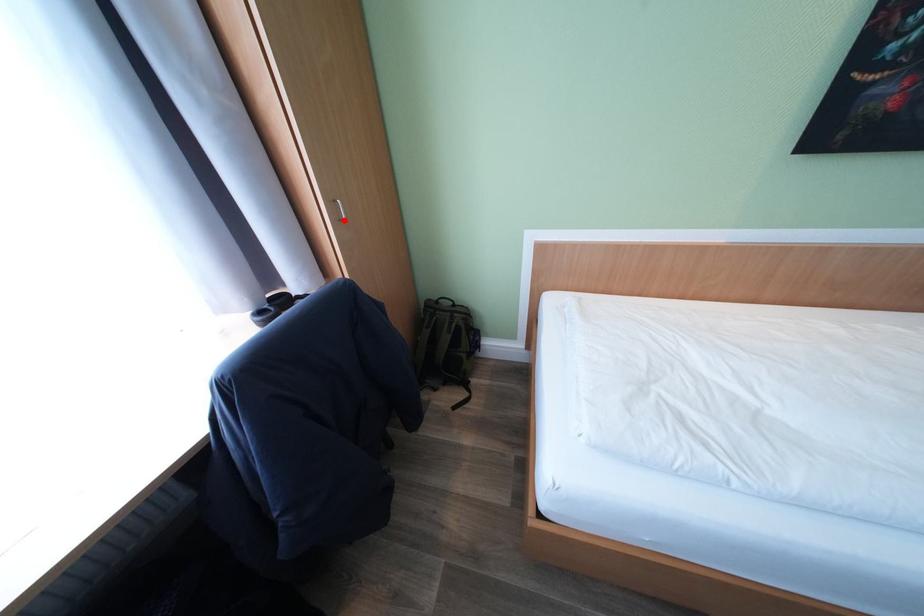
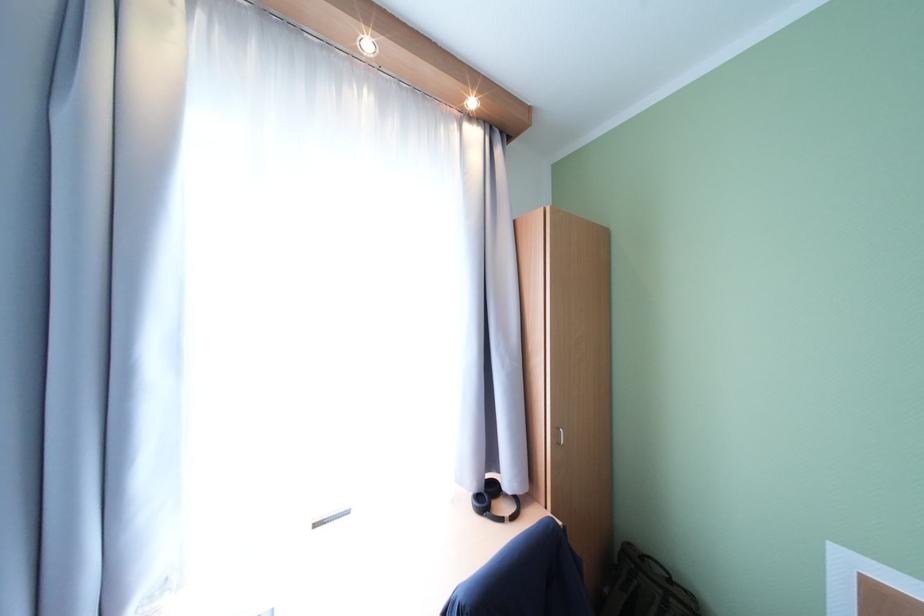
Find the pixel in the second image that matches the highlighted location in the first image.

(563, 444)